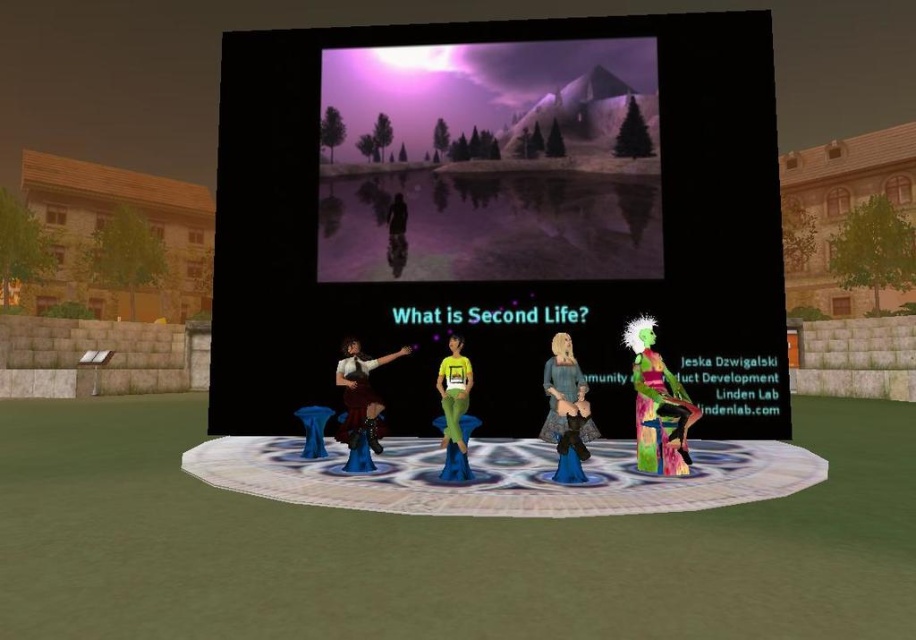
Does multicolored fabric figure at center have a larger size compared to smooth black figure at center?

Yes, multicolored fabric figure at center is bigger than smooth black figure at center.

Which is behind, point (653, 417) or point (399, 221)?

Positioned behind is point (399, 221).

What are the coordinates of `multicolored fabric figure at center` in the screenshot? It's located at (657, 404).

At what (x,y) coordinates should I click in order to perform the action: click on multicolored fabric figure at center. Please return your answer as a coordinate pair (x, y). The image size is (916, 640). Looking at the image, I should click on (657, 404).

Consider the image. Is matte black screen at center above matte brown dress at center?

Indeed, matte black screen at center is positioned over matte brown dress at center.

Is point (755, 19) closer to viewer compared to point (347, 433)?

That is False.

The height and width of the screenshot is (640, 916). What do you see at coordinates (499, 218) in the screenshot?
I see `matte black screen at center` at bounding box center [499, 218].

Image resolution: width=916 pixels, height=640 pixels. In order to click on matte black screen at center in this screenshot , I will do `click(499, 218)`.

In the scene shown: Can you confirm if matte black screen at center is thinner than smooth black figure at center?

Incorrect, matte black screen at center's width is not less than smooth black figure at center's.

Who is positioned more to the right, matte black screen at center or smooth black figure at center?

matte black screen at center is more to the right.

What do you see at coordinates (499, 218) in the screenshot? This screenshot has width=916, height=640. I see `matte black screen at center` at bounding box center [499, 218].

Where is `matte black screen at center`? matte black screen at center is located at coordinates (499, 218).